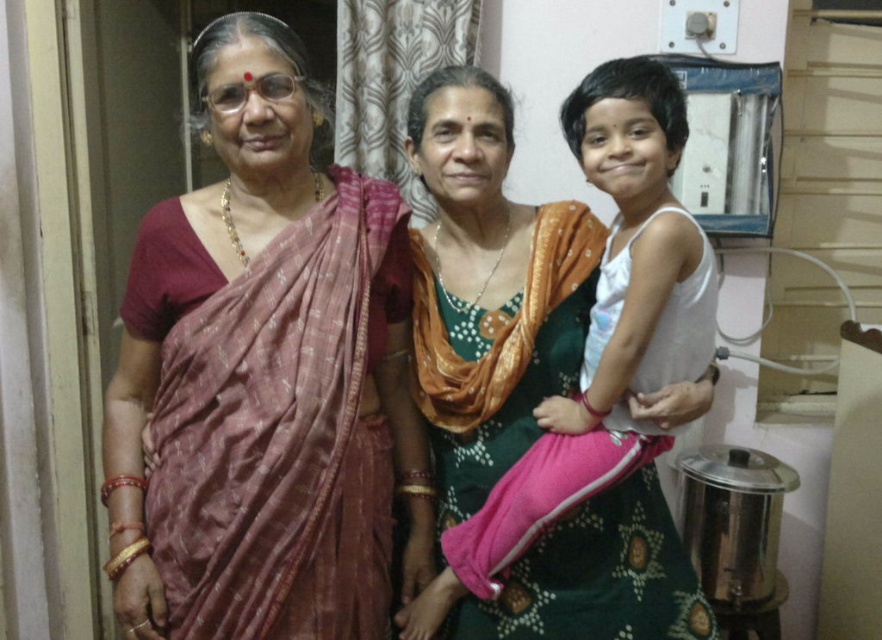
Question: Can you confirm if matte pink sari at center is positioned below green silk sari at center?

Choices:
 (A) no
 (B) yes

Answer: (A)

Question: Can you confirm if matte pink sari at center is positioned above green silk sari at center?

Choices:
 (A) yes
 (B) no

Answer: (A)

Question: Is matte pink sari at center closer to the viewer compared to green silk sari at center?

Choices:
 (A) yes
 (B) no

Answer: (A)

Question: Among these objects, which one is nearest to the camera?

Choices:
 (A) green silk sari at center
 (B) matte pink sari at center

Answer: (B)

Question: Which object is closer to the camera taking this photo?

Choices:
 (A) green silk sari at center
 (B) matte pink sari at center

Answer: (B)